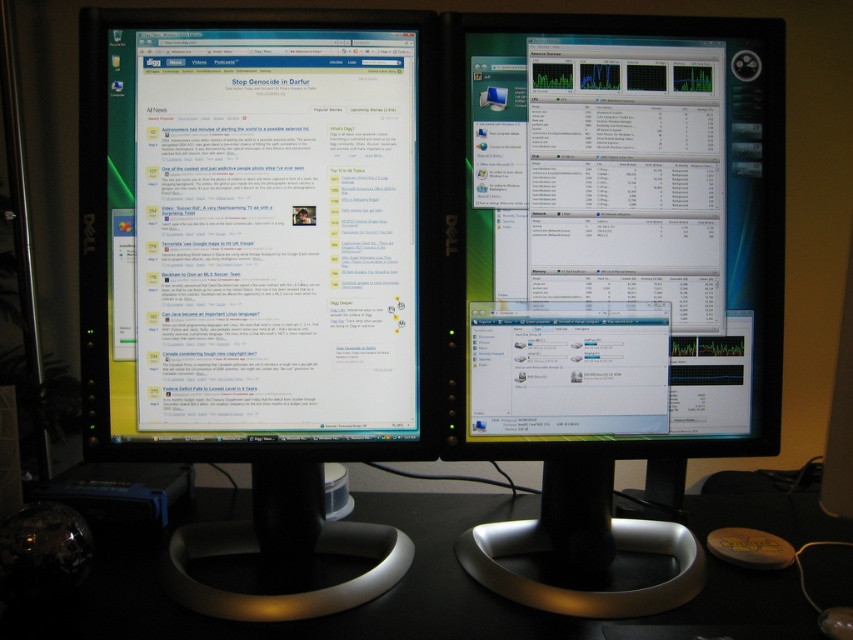
Question: Where is matte black monitor at right located in relation to black plastic computer desk at center in the image?

Choices:
 (A) above
 (B) below

Answer: (A)

Question: Which object is positioned farthest from the matte black monitor at right?

Choices:
 (A) black plastic computer desk at center
 (B) black glossy monitor at left

Answer: (A)

Question: Which point is farther to the camera?

Choices:
 (A) black plastic computer desk at center
 (B) black glossy monitor at left

Answer: (B)

Question: Is black glossy monitor at left thinner than matte black monitor at right?

Choices:
 (A) yes
 (B) no

Answer: (B)

Question: Which of the following is the farthest from the observer?

Choices:
 (A) (387, 611)
 (B) (552, 16)

Answer: (B)

Question: Can you confirm if matte black monitor at right is positioned to the left of black plastic computer desk at center?

Choices:
 (A) yes
 (B) no

Answer: (B)